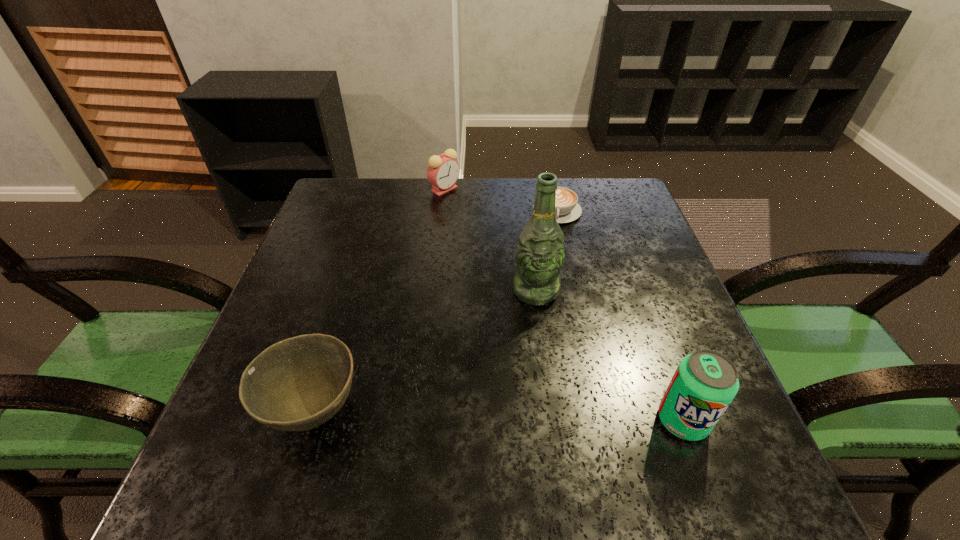
Locate an element on the screen. The image size is (960, 540). free space on the desktop that is between the bowl and the rightmost object and is positioned on the side of the cappuccino with the handle is located at coordinates (x=550, y=417).

At what (x,y) coordinates should I click in order to perform the action: click on free space on the desktop that is between the bowl and the pop soda and is positioned on the face of the alarm clock. Please return your answer as a coordinate pair (x, y). The height and width of the screenshot is (540, 960). Looking at the image, I should click on (450, 414).

Find the location of a particular element. The image size is (960, 540). free space on the desktop that is between the bowl and the second tallest object and is positioned on the surface of the beer bottle is located at coordinates (542, 416).